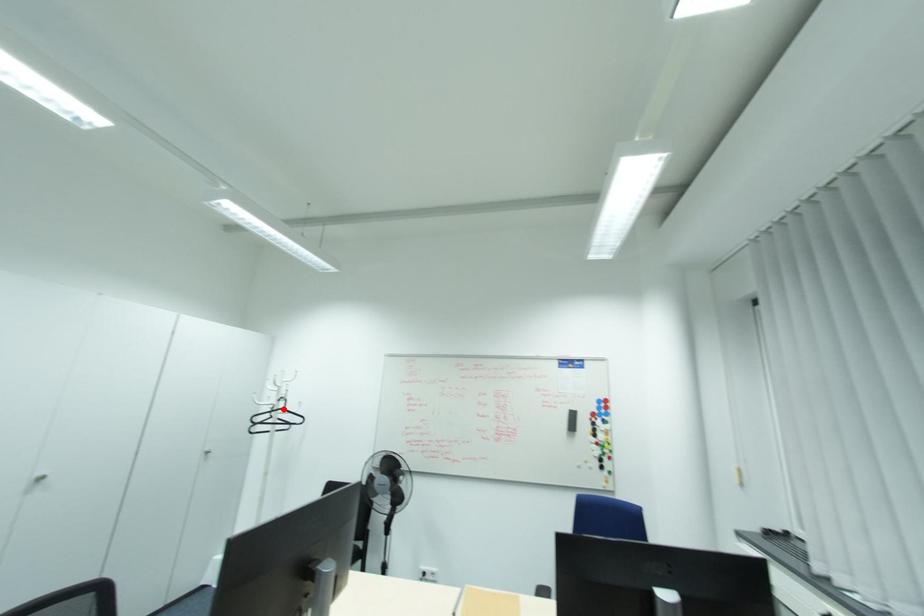
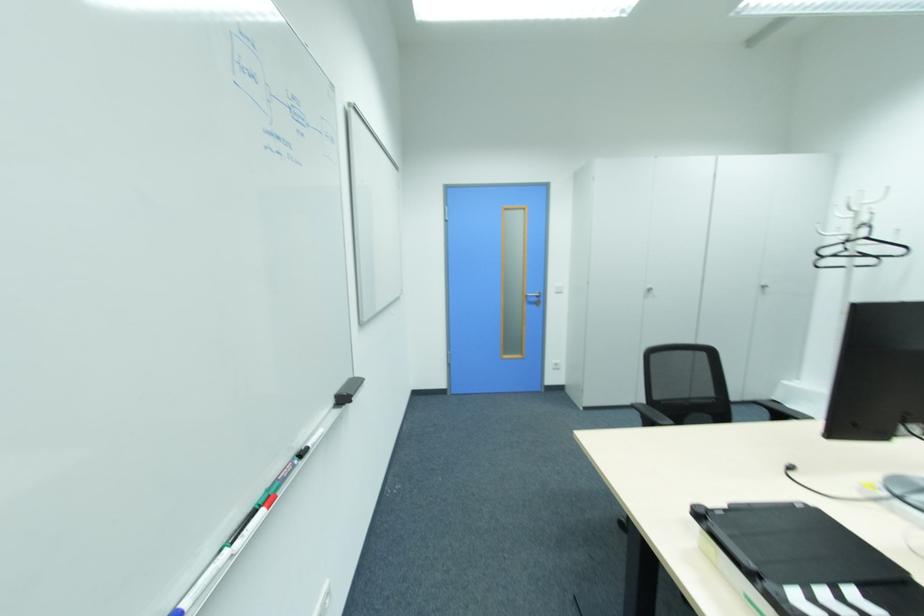
Find the pixel in the second image that matches the highlighted location in the first image.

(865, 238)